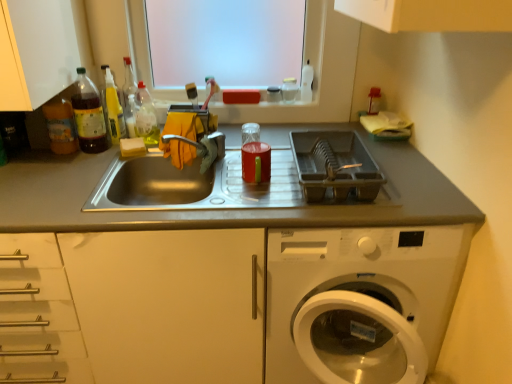
What is the approximate width of translucent plastic bottle at left, which is the third bottle from right to left?

The width of translucent plastic bottle at left, which is the third bottle from right to left, is 2.80 inches.

Locate an element on the screen. This screenshot has width=512, height=384. translucent plastic bottle at left, which is the third bottle from right to left is located at coordinates (89, 116).

What is the approximate height of transparent plastic window screen at upper center?

It is 17.52 inches.

The height and width of the screenshot is (384, 512). What do you see at coordinates (145, 116) in the screenshot?
I see `translucent plastic bottle at upper left, which ranks as the 1th bottle in right-to-left order` at bounding box center [145, 116].

The width and height of the screenshot is (512, 384). Describe the element at coordinates (60, 125) in the screenshot. I see `translucent plastic bottle at left, the 1th bottle viewed from the left` at that location.

Looking at this image, measure the distance between point (133, 147) and camera.

The distance of point (133, 147) from camera is 5.39 feet.

Where is `translucent plastic bottle at left, which is the third bottle from right to left`? The image size is (512, 384). translucent plastic bottle at left, which is the third bottle from right to left is located at coordinates pyautogui.click(x=89, y=116).

Is plastic dish rack at right positioned with its back to metallic sink at center, positioned as the 1th countertop in left-to-right order?

That's not correct — plastic dish rack at right is not looking away from metallic sink at center, positioned as the 1th countertop in left-to-right order.

Which is farther, (333, 156) or (278, 153)?

The point (278, 153) is farther.

The image size is (512, 384). I want to click on appliance above the metallic sink at center, the 2th countertop when ordered from right to left (from the image's perspective), so click(x=334, y=165).

Which is correct: plastic dish rack at right is inside metallic sink at center, positioned as the 1th countertop in left-to-right order, or outside of it?

plastic dish rack at right exists outside the volume of metallic sink at center, positioned as the 1th countertop in left-to-right order.

From the image's perspective, count 1st countertops downward from the translucent plastic bottle at left, marked as the second bottle in a left-to-right arrangement, and point to it. Please provide its 2D coordinates.

[(223, 209)]

Considering the sizes of objects stainless steel sink at center, the first countertop in the right-to-left sequence, and translucent plastic bottle at left, marked as the second bottle in a left-to-right arrangement, in the image provided, who is shorter, stainless steel sink at center, the first countertop in the right-to-left sequence, or translucent plastic bottle at left, marked as the second bottle in a left-to-right arrangement,?

stainless steel sink at center, the first countertop in the right-to-left sequence, is shorter.

Considering the relative positions of stainless steel sink at center, which is the 2th countertop in left-to-right order, and translucent plastic bottle at left, which is the third bottle from right to left, in the image provided, is stainless steel sink at center, which is the 2th countertop in left-to-right order, to the left or to the right of translucent plastic bottle at left, which is the third bottle from right to left,?

In the image, stainless steel sink at center, which is the 2th countertop in left-to-right order, appears on the right side of translucent plastic bottle at left, which is the third bottle from right to left.

Which object is more forward, plastic dish rack at right or translucent plastic bottle at left, the 1th bottle viewed from the left?

plastic dish rack at right is in front.

From the image's perspective, which one is positioned higher, plastic dish rack at right or translucent plastic bottle at left, the 1th bottle viewed from the left?

translucent plastic bottle at left, the 1th bottle viewed from the left, appears higher in the image.

From a real-world perspective, is plastic dish rack at right physically above translucent plastic bottle at left, the 4th bottle viewed from the right?

No.

How many degrees apart are the facing directions of plastic dish rack at right and translucent plastic bottle at left, the 1th bottle viewed from the left?

0.745 degrees separate the facing orientations of plastic dish rack at right and translucent plastic bottle at left, the 1th bottle viewed from the left.

Considering the relative sizes of translucent plastic bottle at left, the 4th bottle viewed from the right, and translucent plastic bottle at left, the third bottle from the left, in the image provided, is translucent plastic bottle at left, the 4th bottle viewed from the right, taller than translucent plastic bottle at left, the third bottle from the left,?

No.

Which is nearer, (54, 124) or (121, 135)?

Point (54, 124) is positioned closer to the camera compared to point (121, 135).

How many degrees apart are the facing directions of translucent plastic bottle at left, the 4th bottle viewed from the right, and translucent plastic bottle at left, the third bottle from the left?

2.81 degrees.

Is translucent plastic bottle at left, the 1th bottle viewed from the left, positioned before translucent plastic bottle at left, the third bottle from the left?

Yes.

In terms of width, does translucent plastic bottle at left, the third bottle from the left, look wider or thinner when compared to transparent plastic window screen at upper center?

Result: Clearly, translucent plastic bottle at left, the third bottle from the left, has less width compared to transparent plastic window screen at upper center.

Is point (117, 106) closer or farther from the camera than point (285, 30)?

Point (117, 106) is closer to the camera than point (285, 30).

Are translucent plastic bottle at left, acting as the second bottle starting from the right, and transparent plastic window screen at upper center beside each other?

translucent plastic bottle at left, acting as the second bottle starting from the right, and transparent plastic window screen at upper center are clearly separated.

Could you tell me if translucent plastic bottle at left, acting as the second bottle starting from the right, is facing transparent plastic window screen at upper center?

No.

In the scene shown: Between transparent plastic window screen at upper center and translucent plastic bottle at left, the 4th bottle viewed from the right, which one has larger width?

transparent plastic window screen at upper center is wider.

Is transparent plastic window screen at upper center shorter than translucent plastic bottle at left, the 4th bottle viewed from the right?

Incorrect, the height of transparent plastic window screen at upper center does not fall short of that of translucent plastic bottle at left, the 4th bottle viewed from the right.

Is translucent plastic bottle at left, which is the third bottle from right to left, aimed at translucent plastic bottle at upper left, which ranks as the 1th bottle in right-to-left order?

No, translucent plastic bottle at left, which is the third bottle from right to left, does not turn towards translucent plastic bottle at upper left, which ranks as the 1th bottle in right-to-left order.

From a real-world perspective, between translucent plastic bottle at left, which is the third bottle from right to left, and translucent plastic bottle at upper left, which ranks as the 1th bottle in right-to-left order, who is vertically higher?

In real-world perspective, translucent plastic bottle at left, which is the third bottle from right to left, is above.

Can you confirm if translucent plastic bottle at left, which is the third bottle from right to left, is wider than translucent plastic bottle at upper left, which ranks as the 1th bottle in right-to-left order?

Incorrect, the width of translucent plastic bottle at left, which is the third bottle from right to left, does not surpass that of translucent plastic bottle at upper left, which ranks as the 1th bottle in right-to-left order.

Is translucent plastic bottle at left, which is the third bottle from right to left, spatially inside translucent plastic bottle at upper left, which ranks as the 1th bottle in right-to-left order, or outside of it?

The correct answer is: outside.

From the plastic dish rack at right, count the 2nd countertop to the left and point to it. Please provide its 2D coordinates.

[(221, 271)]

I want to click on the 1st bottle behind the stainless steel sink at center, the first countertop in the right-to-left sequence, starting your count from the anchor, so click(89, 116).

From the picture: Which object lies nearer to the anchor point stainless steel sink at center, which is the 2th countertop in left-to-right order, translucent plastic bottle at left, the 4th bottle viewed from the right, or translucent plastic bottle at left, the third bottle from the left?

translucent plastic bottle at left, the 4th bottle viewed from the right.

When comparing their distances from translucent plastic bottle at left, marked as the second bottle in a left-to-right arrangement, does translucent plastic bottle at left, the 4th bottle viewed from the right, or translucent plastic bottle at left, acting as the second bottle starting from the right, seem closer?

Based on the image, translucent plastic bottle at left, the 4th bottle viewed from the right, appears to be nearer to translucent plastic bottle at left, marked as the second bottle in a left-to-right arrangement.

Looking at this image, considering their positions, is translucent plastic bottle at left, marked as the second bottle in a left-to-right arrangement, positioned closer to metallic sink at center, the 2th countertop when ordered from right to left, than white sponge at sink left?

Based on the image, translucent plastic bottle at left, marked as the second bottle in a left-to-right arrangement, appears to be nearer to metallic sink at center, the 2th countertop when ordered from right to left.

Considering their positions, is white sponge at sink left positioned further to plastic dish rack at right than metallic sink at center, positioned as the 1th countertop in left-to-right order?

The object further to plastic dish rack at right is white sponge at sink left.

Considering their positions, is translucent plastic bottle at left, marked as the second bottle in a left-to-right arrangement, positioned further to white sponge at sink left than metallic sink at center, the 2th countertop when ordered from right to left?

Based on the image, metallic sink at center, the 2th countertop when ordered from right to left, appears to be further to white sponge at sink left.

Estimate the real-world distances between objects in this image. Which object is closer to stainless steel sink at center, which is the 2th countertop in left-to-right order, plastic dish rack at right or translucent plastic bottle at upper left, which ranks as the 1th bottle in right-to-left order?

plastic dish rack at right is closer to stainless steel sink at center, which is the 2th countertop in left-to-right order.

Which object lies nearer to the anchor point stainless steel sink at center, which is the 2th countertop in left-to-right order, translucent plastic bottle at upper left, which ranks as the 1th bottle in right-to-left order, or plastic dish rack at right?

The object closer to stainless steel sink at center, which is the 2th countertop in left-to-right order, is plastic dish rack at right.

Estimate the real-world distances between objects in this image. Which object is closer to translucent plastic bottle at left, the 4th bottle viewed from the right, translucent plastic bottle at upper left, which appears as the fourth bottle when viewed from the left, or white sponge at sink left?

white sponge at sink left.

The width and height of the screenshot is (512, 384). What are the coordinates of `countertop between translucent plastic bottle at upper left, which appears as the fourth bottle when viewed from the left, and metallic sink at center, the 2th countertop when ordered from right to left, from top to bottom` in the screenshot? It's located at (223, 209).

Find the location of a particular element. The height and width of the screenshot is (384, 512). countertop between translucent plastic bottle at left, the 4th bottle viewed from the right, and stainless steel sink at center, which is the 2th countertop in left-to-right order, in the horizontal direction is located at coordinates (221, 271).

Where is `food between translucent plastic bottle at left, the 4th bottle viewed from the right, and metallic sink at center, the 2th countertop when ordered from right to left, from top to bottom`? Image resolution: width=512 pixels, height=384 pixels. food between translucent plastic bottle at left, the 4th bottle viewed from the right, and metallic sink at center, the 2th countertop when ordered from right to left, from top to bottom is located at coordinates (132, 147).

I want to click on food located between translucent plastic bottle at left, which is the third bottle from right to left, and plastic dish rack at right in the left-right direction, so click(x=132, y=147).